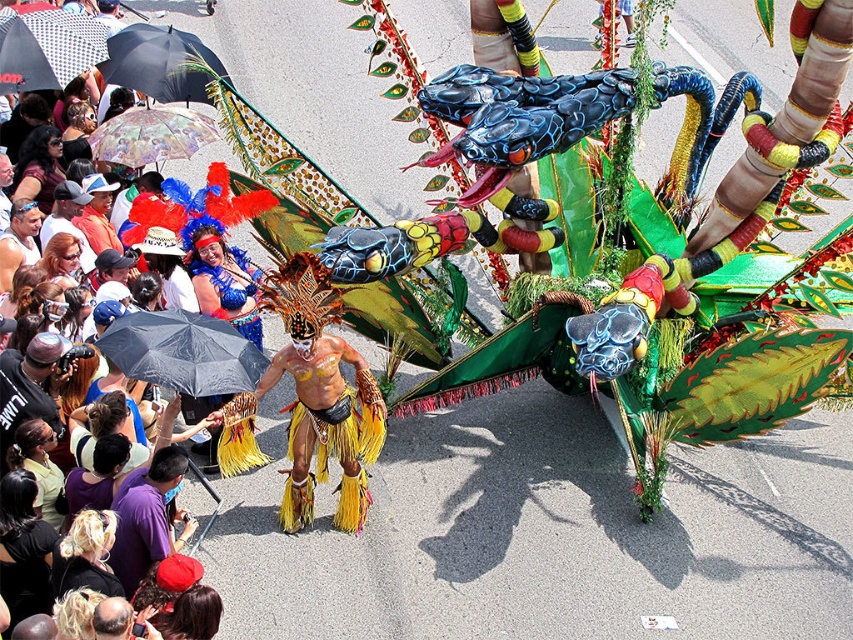
Question: Does purple fabric shirt at lower left appear under multicolored printed fabric umbrella at upper left?

Choices:
 (A) no
 (B) yes

Answer: (B)

Question: Which point is farther to the camera?

Choices:
 (A) (78, 60)
 (B) (144, 502)

Answer: (A)

Question: Is black matte umbrella at left closer to camera compared to black fabric umbrella at upper left?

Choices:
 (A) yes
 (B) no

Answer: (A)

Question: Among these objects, which one is nearest to the camera?

Choices:
 (A) multicolored printed fabric umbrella at upper left
 (B) black dotted umbrella at upper left
 (C) purple fabric shirt at lower left
 (D) black matte umbrella at left

Answer: (C)

Question: Does black matte umbrella at left come in front of purple fabric shirt at lower left?

Choices:
 (A) no
 (B) yes

Answer: (A)

Question: Among these points, which one is nearest to the camera?

Choices:
 (A) (161, 552)
 (B) (200, 99)
 (C) (35, 86)
 (D) (183, 364)

Answer: (A)